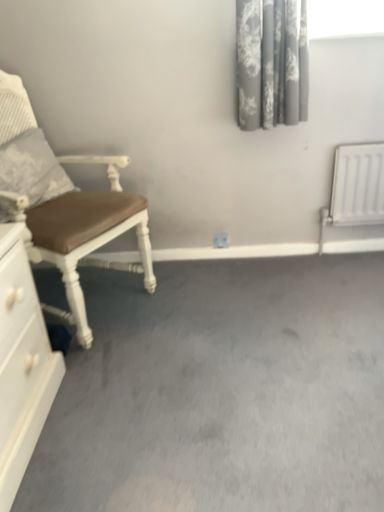
The image size is (384, 512). I want to click on white glossy chest of drawers at lower left, so pyautogui.click(x=22, y=364).

Consider the image. Is textured gray pillow at left inside gray carpet at center?

No, textured gray pillow at left is not surrounded by gray carpet at center.

In the scene shown: From the image's perspective, is gray carpet at center under textured gray pillow at left?

Yes, from the image's perspective, gray carpet at center is below textured gray pillow at left.

Considering the relative sizes of gray carpet at center and textured gray pillow at left in the image provided, is gray carpet at center thinner than textured gray pillow at left?

In fact, gray carpet at center might be wider than textured gray pillow at left.

In terms of height, does textured gray pillow at left look taller or shorter compared to gray carpet at center?

A: Clearly, textured gray pillow at left is taller compared to gray carpet at center.

Is there a large distance between textured gray pillow at left and gray carpet at center?

They are positioned close to each other.

Which object is positioned more to the left, textured gray pillow at left or gray carpet at center?

From the viewer's perspective, textured gray pillow at left appears more on the left side.

From a real-world perspective, which is physically above, textured gray pillow at left or gray carpet at center?

textured gray pillow at left is physically above.

In the image, there is a gray floral fabric curtain at upper right. What are the coordinates of `chair below it (from a real-world perspective)` in the screenshot? It's located at (68, 209).

Between brown leather chair at left and gray floral fabric curtain at upper right, which one has larger width?

With larger width is brown leather chair at left.

Is brown leather chair at left aimed at gray floral fabric curtain at upper right?

No, brown leather chair at left is not oriented towards gray floral fabric curtain at upper right.

Is white glossy chest of drawers at lower left surrounded by gray floral fabric curtain at upper right?

No, white glossy chest of drawers at lower left is not a part of gray floral fabric curtain at upper right.

From the image's perspective, is gray floral fabric curtain at upper right positioned above or below white glossy chest of drawers at lower left?

Clearly, from the image's perspective, gray floral fabric curtain at upper right is above white glossy chest of drawers at lower left.

Does gray floral fabric curtain at upper right have a greater width compared to white glossy chest of drawers at lower left?

No, gray floral fabric curtain at upper right is not wider than white glossy chest of drawers at lower left.

From a real-world perspective, is gray floral fabric curtain at upper right physically located above or below white glossy chest of drawers at lower left?

gray floral fabric curtain at upper right is situated higher than white glossy chest of drawers at lower left in the real world.

Considering the sizes of objects gray carpet at center and gray floral fabric curtain at upper right in the image provided, who is smaller, gray carpet at center or gray floral fabric curtain at upper right?

gray floral fabric curtain at upper right is smaller.

Is gray carpet at center facing towards gray floral fabric curtain at upper right?

No, gray carpet at center is not turned towards gray floral fabric curtain at upper right.

From a real-world perspective, is gray carpet at center physically above gray floral fabric curtain at upper right?

No, from a real-world perspective, gray carpet at center is not on top of gray floral fabric curtain at upper right.

Considering the points (59, 279) and (241, 47), which point is in front, point (59, 279) or point (241, 47)?

The point (241, 47) is closer.

Is point (37, 166) positioned after point (12, 170)?

Yes, point (37, 166) is farther from viewer.

Between textured gray pillow at left and brown leather chair at left, which one has larger width?

Answer: With larger width is brown leather chair at left.

Is textured gray pillow at left far from brown leather chair at left?

No.

Is brown leather chair at left closer to camera compared to gray carpet at center?

No, brown leather chair at left is further to the viewer.

Considering the relative positions of brown leather chair at left and gray carpet at center in the image provided, is brown leather chair at left to the left of gray carpet at center from the viewer's perspective?

Yes, brown leather chair at left is to the left of gray carpet at center.

Who is smaller, brown leather chair at left or gray carpet at center?

With smaller size is gray carpet at center.

The width and height of the screenshot is (384, 512). I want to click on concrete on the right of brown leather chair at left, so click(221, 391).

Locate an element on the screen. pillow on the left of gray carpet at center is located at coordinates (32, 168).

Find the location of a particular element. The height and width of the screenshot is (512, 384). concrete on the right of textured gray pillow at left is located at coordinates (221, 391).

Based on their spatial positions, is gray floral fabric curtain at upper right or gray carpet at center closer to textured gray pillow at left?

Answer: Among the two, gray carpet at center is located nearer to textured gray pillow at left.

Looking at the image, which one is located further to textured gray pillow at left, gray floral fabric curtain at upper right or brown leather chair at left?

gray floral fabric curtain at upper right.

Consider the image. From the image, which object appears to be farther from gray carpet at center, textured gray pillow at left or brown leather chair at left?

Among the two, textured gray pillow at left is located further to gray carpet at center.

Which object lies nearer to the anchor point textured gray pillow at left, white glossy chest of drawers at lower left or brown leather chair at left?

The object closer to textured gray pillow at left is brown leather chair at left.

From the picture: Based on their spatial positions, is gray carpet at center or textured gray pillow at left closer to white glossy chest of drawers at lower left?

gray carpet at center.

Which object lies further to the anchor point gray floral fabric curtain at upper right, textured gray pillow at left or brown leather chair at left?

Based on the image, textured gray pillow at left appears to be further to gray floral fabric curtain at upper right.

Looking at the image, which one is located further to gray floral fabric curtain at upper right, white glossy chest of drawers at lower left or brown leather chair at left?

Based on the image, white glossy chest of drawers at lower left appears to be further to gray floral fabric curtain at upper right.

When comparing their distances from white glossy chest of drawers at lower left, does gray carpet at center or brown leather chair at left seem further?

The object further to white glossy chest of drawers at lower left is gray carpet at center.

This screenshot has height=512, width=384. I want to click on pillow between gray floral fabric curtain at upper right and gray carpet at center in the up-down direction, so 32,168.

I want to click on chest of drawers between textured gray pillow at left and gray floral fabric curtain at upper right, so click(x=22, y=364).

I want to click on chest of drawers between textured gray pillow at left and gray carpet at center, so click(22, 364).

Identify the location of chair between textured gray pillow at left and gray carpet at center from left to right. The image size is (384, 512). (68, 209).